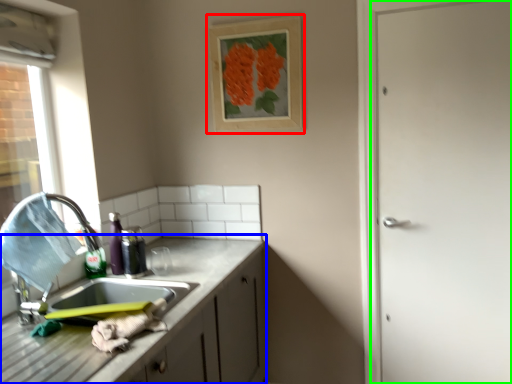
Question: Which object is positioned farthest from picture frame (highlighted by a red box)? Select from cabinetry (highlighted by a blue box) and door (highlighted by a green box).

Choices:
 (A) cabinetry
 (B) door

Answer: (A)